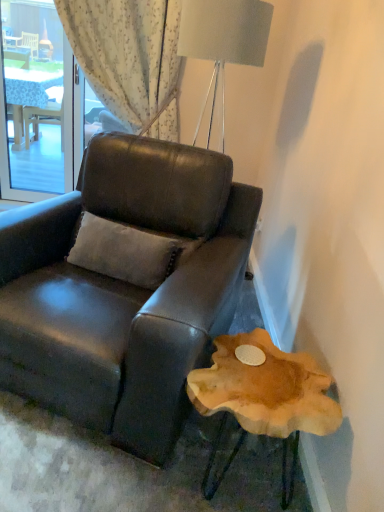
Question: Could you tell me if natural wood side table at lower right is facing suede-like beige pillow at center?

Choices:
 (A) no
 (B) yes

Answer: (A)

Question: Does natural wood side table at lower right appear on the left side of suede-like beige pillow at center?

Choices:
 (A) no
 (B) yes

Answer: (A)

Question: From a real-world perspective, is natural wood side table at lower right on suede-like beige pillow at center?

Choices:
 (A) yes
 (B) no

Answer: (B)

Question: Is natural wood side table at lower right taller than suede-like beige pillow at center?

Choices:
 (A) yes
 (B) no

Answer: (A)

Question: Is the position of natural wood side table at lower right less distant than that of suede-like beige pillow at center?

Choices:
 (A) yes
 (B) no

Answer: (A)

Question: Is natural wood side table at lower right to the right of suede-like beige pillow at center from the viewer's perspective?

Choices:
 (A) yes
 (B) no

Answer: (A)

Question: Does matte black leather chair at center have a greater width compared to transparent glass window at upper left?

Choices:
 (A) yes
 (B) no

Answer: (A)

Question: Is transparent glass window at upper left at the back of matte black leather chair at center?

Choices:
 (A) no
 (B) yes

Answer: (A)

Question: From the image's perspective, is matte black leather chair at center above transparent glass window at upper left?

Choices:
 (A) no
 (B) yes

Answer: (A)

Question: Can you confirm if matte black leather chair at center is thinner than transparent glass window at upper left?

Choices:
 (A) no
 (B) yes

Answer: (A)

Question: Does matte black leather chair at center have a smaller size compared to transparent glass window at upper left?

Choices:
 (A) yes
 (B) no

Answer: (B)

Question: Does matte black leather chair at center lie in front of transparent glass window at upper left?

Choices:
 (A) yes
 (B) no

Answer: (A)

Question: Is transparent glass window at upper left shorter than matte black leather chair at center?

Choices:
 (A) no
 (B) yes

Answer: (A)